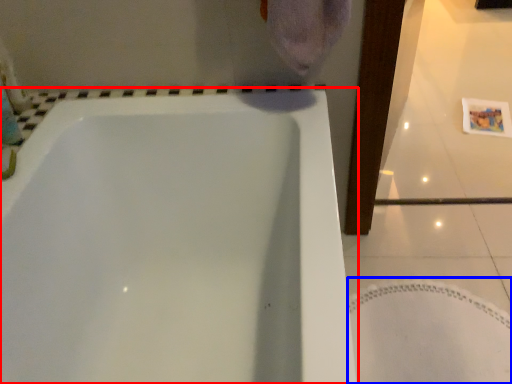
Question: Which of the following is the farthest to the observer, bathtub (highlighted by a red box) or bath mat (highlighted by a blue box)?

Choices:
 (A) bathtub
 (B) bath mat

Answer: (B)